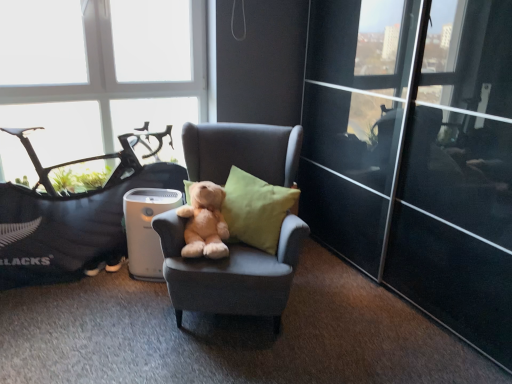
Locate an element on the screen. vacant space in front of matte gray armchair at center is located at coordinates (223, 362).